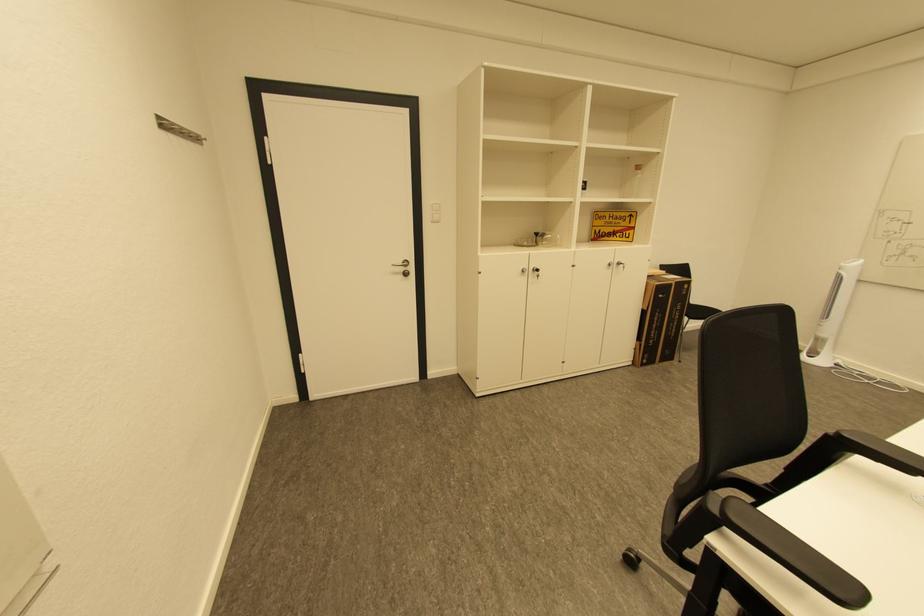
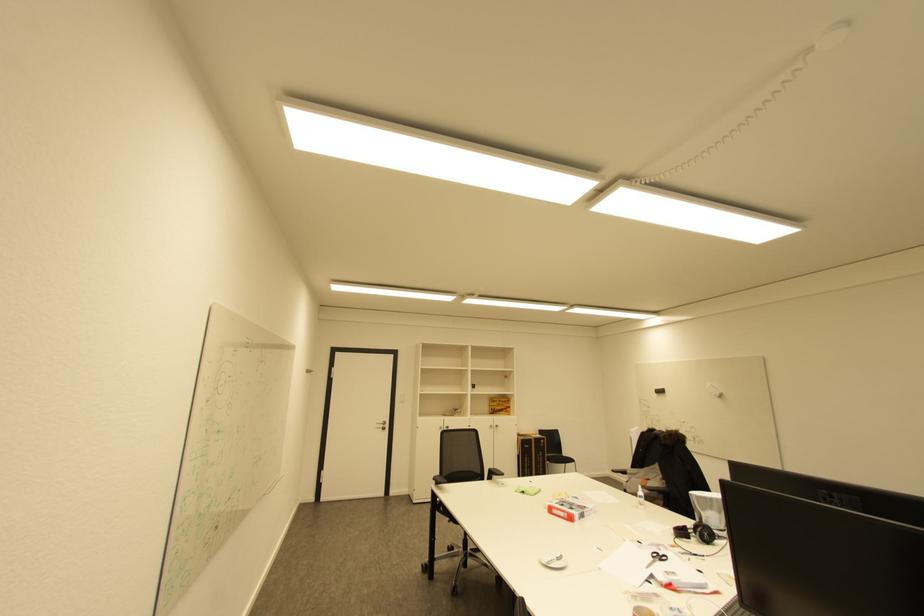
Locate, in the second image, the point that corresponds to the point at 683,283 in the first image.

(541, 439)